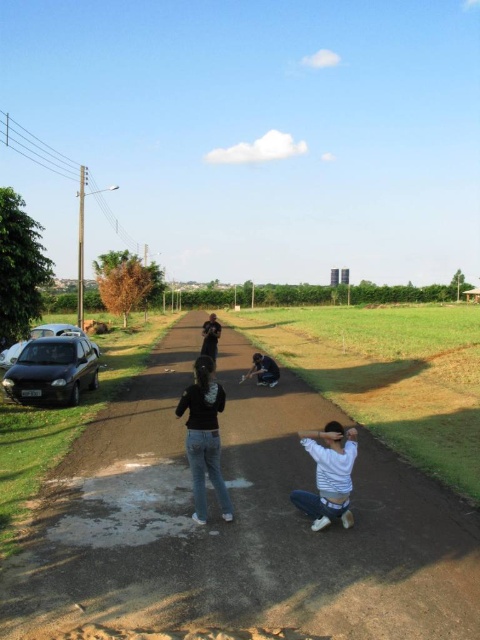
Is point (192, 445) behind point (212, 328)?

No, (192, 445) is closer to viewer.

Which of these two, denim jeans at center or black matte man at center, stands taller?

With more height is black matte man at center.

Is point (211, 448) closer to viewer compared to point (204, 346)?

Yes.

You are a GUI agent. You are given a task and a screenshot of the screen. Output one action in this format:
    pyautogui.click(x=<x>, y=<y>)
    Task: Click on the denim jeans at center
    This screenshot has width=480, height=640.
    Given the screenshot: What is the action you would take?
    pyautogui.click(x=204, y=436)

Does dark gray fabric squat at center have a lesser width compared to black matte man at center?

Yes, dark gray fabric squat at center is thinner than black matte man at center.

Can you confirm if dark gray fabric squat at center is shorter than black matte man at center?

Correct, dark gray fabric squat at center is not as tall as black matte man at center.

Measure the distance between point (x=241, y=378) and camera.

Point (x=241, y=378) and camera are 56.00 feet apart from each other.

Identify the location of dark gray fabric squat at center. This screenshot has height=640, width=480. (263, 371).

Is matte black car at lower left smaller than black matte man at center?

Yes, matte black car at lower left is smaller than black matte man at center.

Which of these two, matte black car at lower left or black matte man at center, stands shorter?

With less height is matte black car at lower left.

Where is `matte black car at lower left`? The image size is (480, 640). matte black car at lower left is located at coordinates (52, 371).

Locate an element on the screen. matte black car at lower left is located at coordinates (52, 371).